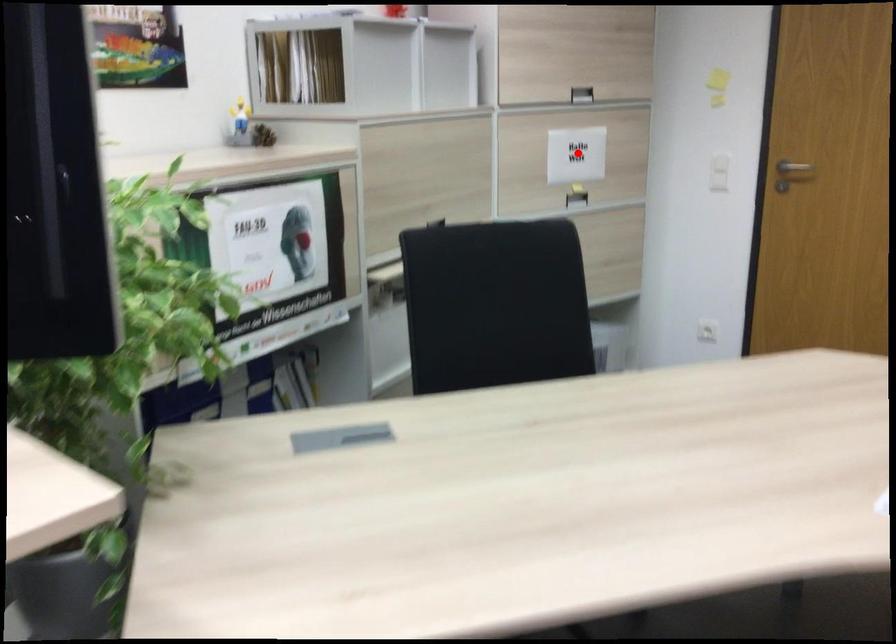
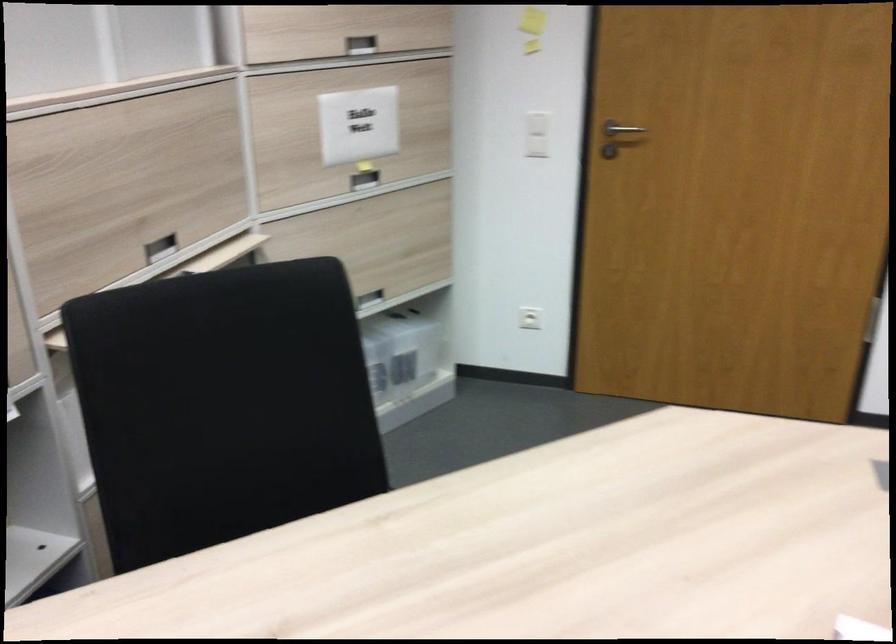
The point at the highlighted location is marked in the first image. Where is the corresponding point in the second image?

(358, 125)